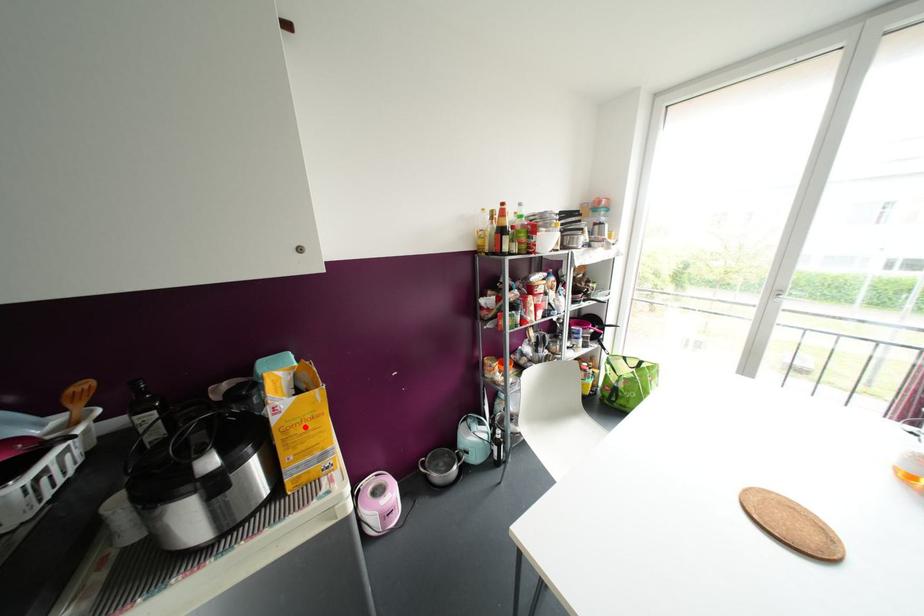
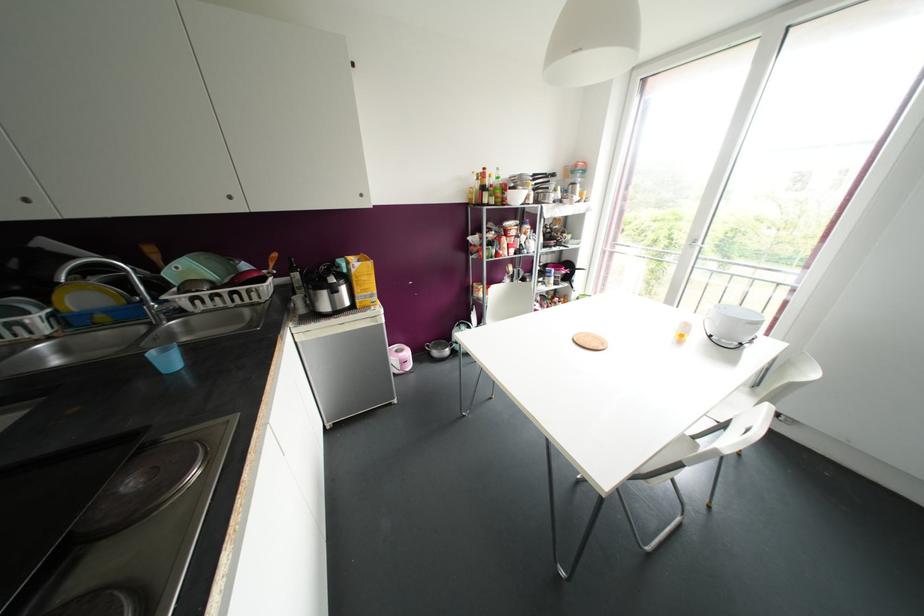
Find the pixel in the second image that matches the highlighted location in the first image.

(363, 277)